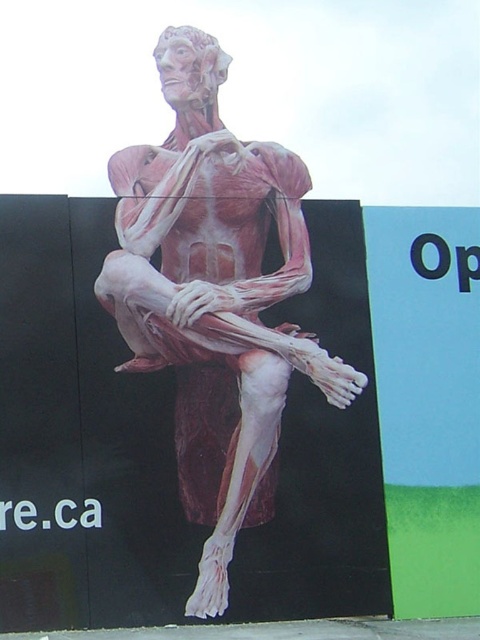
Question: Which object is closer to the camera taking this photo?

Choices:
 (A) blue matte sign at right
 (B) pink flesh-like muscle at center

Answer: (B)

Question: Can you confirm if pink flesh-like muscle at center is positioned to the left of blue matte sign at right?

Choices:
 (A) no
 (B) yes

Answer: (B)

Question: Is pink flesh-like muscle at center below blue matte sign at right?

Choices:
 (A) yes
 (B) no

Answer: (B)

Question: Which of the following is the farthest from the observer?

Choices:
 (A) (131, 179)
 (B) (446, 470)

Answer: (A)

Question: Can you confirm if pink flesh-like muscle at center is positioned below blue matte sign at right?

Choices:
 (A) no
 (B) yes

Answer: (A)

Question: Among these points, which one is nearest to the camera?

Choices:
 (A) (407, 602)
 (B) (303, 340)

Answer: (A)